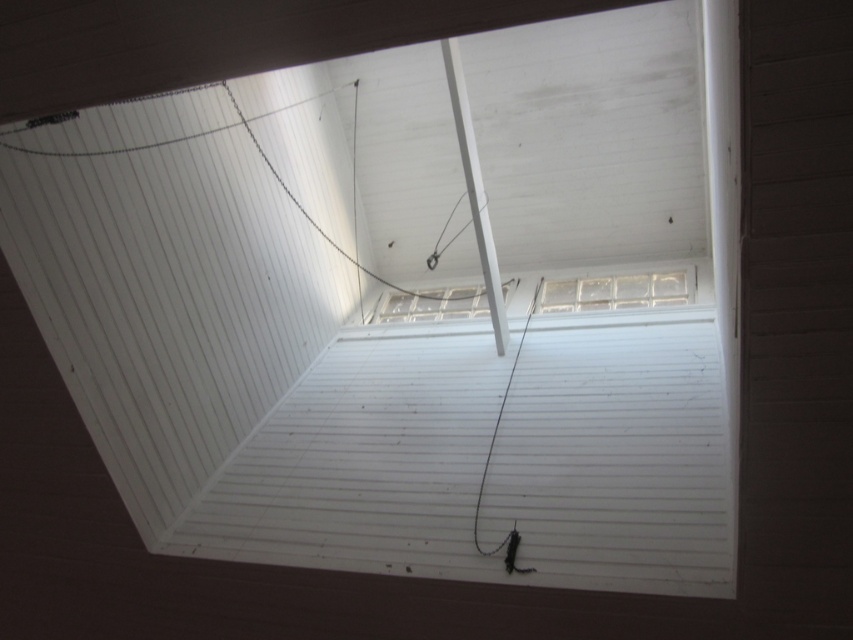
Is white glossy beam at upper center further to the viewer compared to clear glass window at center?

No, white glossy beam at upper center is closer to the viewer.

Is white glossy beam at upper center wider than clear glass window at center?

Incorrect, white glossy beam at upper center's width does not surpass clear glass window at center's.

Where is `white glossy beam at upper center`? Image resolution: width=853 pixels, height=640 pixels. white glossy beam at upper center is located at coordinates (474, 189).

Can you confirm if clear glass window at upper center is positioned to the right of clear glass window at center?

Indeed, clear glass window at upper center is positioned on the right side of clear glass window at center.

How distant is clear glass window at upper center from clear glass window at center?

The distance of clear glass window at upper center from clear glass window at center is 34.60 inches.

Who is more forward, (x=567, y=301) or (x=431, y=296)?

Positioned in front is point (x=567, y=301).

At what (x,y) coordinates should I click in order to perform the action: click on clear glass window at upper center. Please return your answer as a coordinate pair (x, y). The height and width of the screenshot is (640, 853). Looking at the image, I should click on (616, 291).

Can you confirm if white glossy beam at upper center is positioned below clear glass window at upper center?

No.

Which is more to the right, white glossy beam at upper center or clear glass window at upper center?

Positioned to the right is clear glass window at upper center.

Where is `white glossy beam at upper center`? This screenshot has height=640, width=853. white glossy beam at upper center is located at coordinates (474, 189).